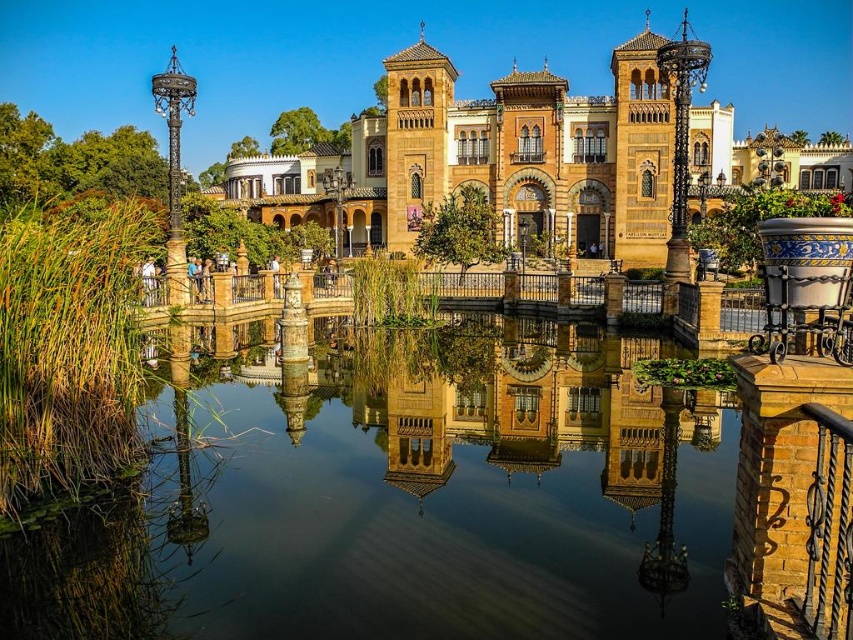
You are standing in front of the grand Spanish colonial building and want to take a photo of the reflection of the building in the transparent water at center. According to the coordinates provided, where should you position yourself to capture the reflection clearly?

To capture the reflection clearly, you should position yourself directly above the transparent water at center located at coordinates point (407, 500), as this is where the reflection of the building is most visible.

You are standing in front of the brown stone palace at center and want to walk to the transparent water at center. Which direction should you move in?

You should move to the left to reach the transparent water at center since it is located to the left of the brown stone palace at center.